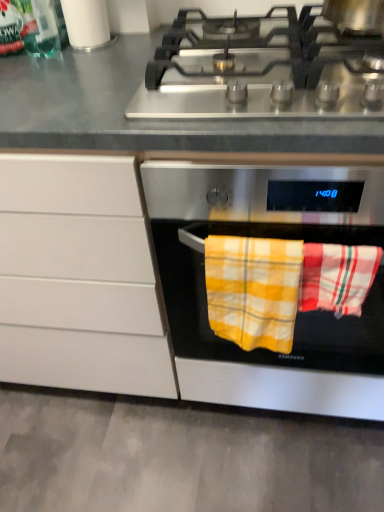
Image resolution: width=384 pixels, height=512 pixels. What are the coordinates of `empty space that is to the right of white paper towel at upper left` in the screenshot? It's located at (140, 37).